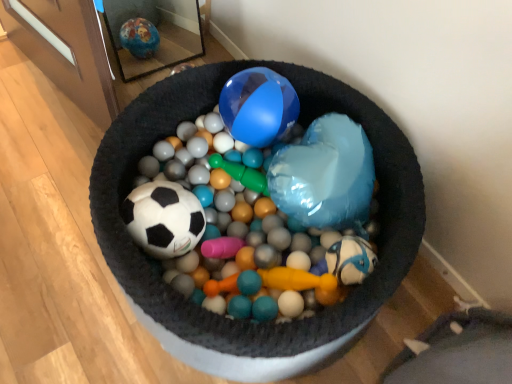
Question: Does matte black soccer ball at center have a lesser height compared to gray fabric bean bag chair at lower right?

Choices:
 (A) no
 (B) yes

Answer: (A)

Question: From the image's perspective, is matte black soccer ball at center located beneath gray fabric bean bag chair at lower right?

Choices:
 (A) no
 (B) yes

Answer: (A)

Question: Is matte black soccer ball at center facing away from gray fabric bean bag chair at lower right?

Choices:
 (A) no
 (B) yes

Answer: (A)

Question: From a real-world perspective, does matte black soccer ball at center stand above gray fabric bean bag chair at lower right?

Choices:
 (A) no
 (B) yes

Answer: (B)

Question: Is matte black soccer ball at center next to gray fabric bean bag chair at lower right and touching it?

Choices:
 (A) yes
 (B) no

Answer: (B)

Question: Is the position of matte black soccer ball at center less distant than that of gray fabric bean bag chair at lower right?

Choices:
 (A) yes
 (B) no

Answer: (A)

Question: Does gray fabric bean bag chair at lower right have a larger size compared to matte black soccer ball at center?

Choices:
 (A) no
 (B) yes

Answer: (A)

Question: Does gray fabric bean bag chair at lower right come in front of matte black soccer ball at center?

Choices:
 (A) no
 (B) yes

Answer: (A)

Question: Is gray fabric bean bag chair at lower right thinner than matte black soccer ball at center?

Choices:
 (A) yes
 (B) no

Answer: (A)

Question: Is gray fabric bean bag chair at lower right shorter than matte black soccer ball at center?

Choices:
 (A) no
 (B) yes

Answer: (B)

Question: Is gray fabric bean bag chair at lower right aimed at matte black soccer ball at center?

Choices:
 (A) yes
 (B) no

Answer: (B)

Question: From a real-world perspective, is gray fabric bean bag chair at lower right over matte black soccer ball at center?

Choices:
 (A) yes
 (B) no

Answer: (B)

Question: In terms of width, does gray fabric bean bag chair at lower right look wider or thinner when compared to matte black soccer ball at center?

Choices:
 (A) wide
 (B) thin

Answer: (B)